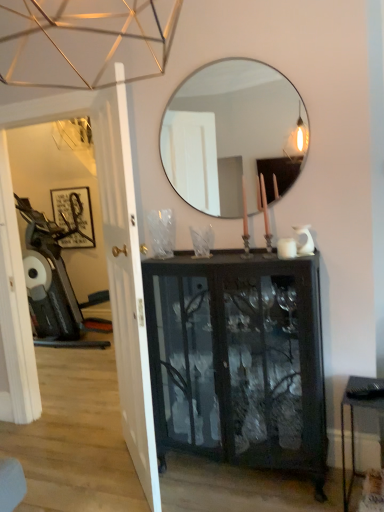
Question: Is point click(x=309, y=402) closer or farther from the camera than point click(x=203, y=123)?

Choices:
 (A) closer
 (B) farther

Answer: (A)

Question: From the image's perspective, is black glass cabinet at center above or below clear glass mirror at upper center?

Choices:
 (A) above
 (B) below

Answer: (B)

Question: Which object is the closest to the white glossy door at left?

Choices:
 (A) metallic silver swivel chair at left
 (B) matte black picture frame at left
 (C) clear glass mirror at upper center
 (D) metallic black table at lower right
 (E) black glass cabinet at center

Answer: (E)

Question: Which object is the farthest from the white glossy door at left?

Choices:
 (A) metallic black table at lower right
 (B) clear glass mirror at upper center
 (C) matte black picture frame at left
 (D) black glass cabinet at center
 (E) metallic silver swivel chair at left

Answer: (C)